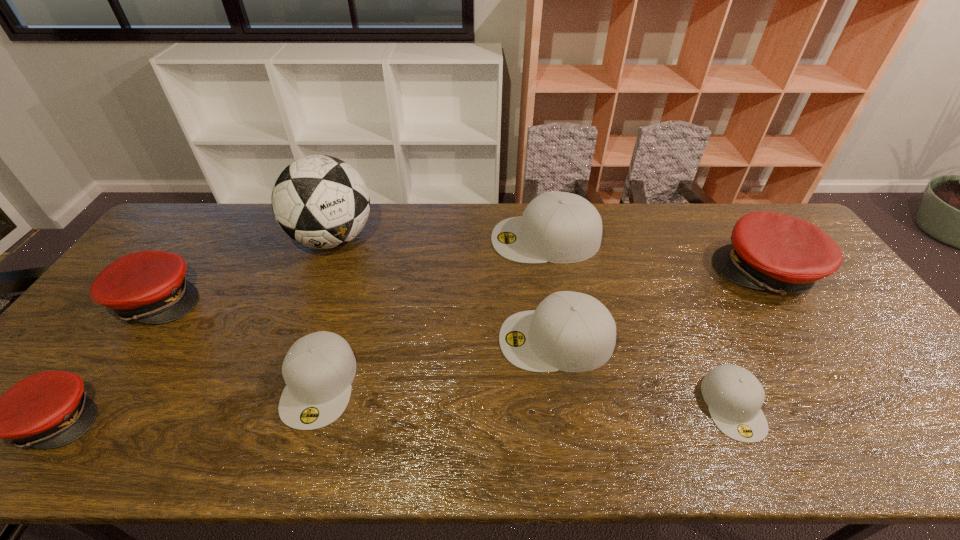
Locate an element on the screen. Image resolution: width=960 pixels, height=540 pixels. vacant space located 0.390m on the front-facing side of the second biggest gray cap is located at coordinates (351, 340).

Identify the location of blank space located on the front of the second smallest red cap with an emblem. The image size is (960, 540). (315, 300).

The width and height of the screenshot is (960, 540). What are the coordinates of `free space located 0.070m on the front-facing side of the third cap from left to right` in the screenshot? It's located at (297, 462).

The image size is (960, 540). Find the location of `soccer ball that is positioned at the far edge`. soccer ball that is positioned at the far edge is located at coordinates (320, 201).

You are a GUI agent. You are given a task and a screenshot of the screen. Output one action in this format:
    pyautogui.click(x=<x>, y=<y>)
    Task: Click on the object located at the left edge
    
    Given the screenshot: What is the action you would take?
    pyautogui.click(x=149, y=286)

In order to click on object at the right edge in this screenshot , I will do `click(770, 251)`.

Image resolution: width=960 pixels, height=540 pixels. Identify the location of object that is at the far right corner. (770, 251).

Locate an element on the screen. This screenshot has height=540, width=960. vacant space at the far edge of the desktop is located at coordinates (484, 204).

Identify the location of free spot at the near edge of the desktop. (224, 444).

In order to click on vacant point at the right edge in this screenshot , I will do `click(881, 397)`.